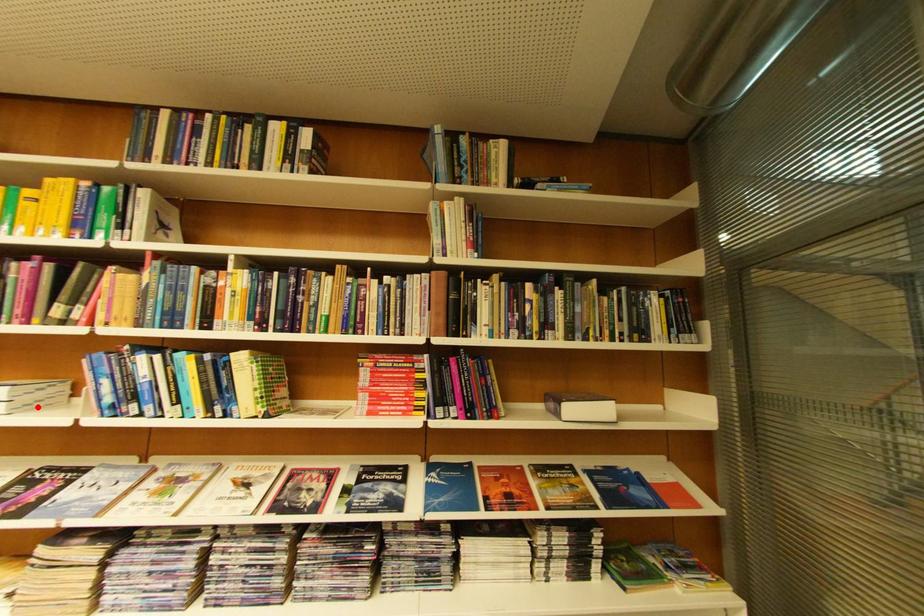
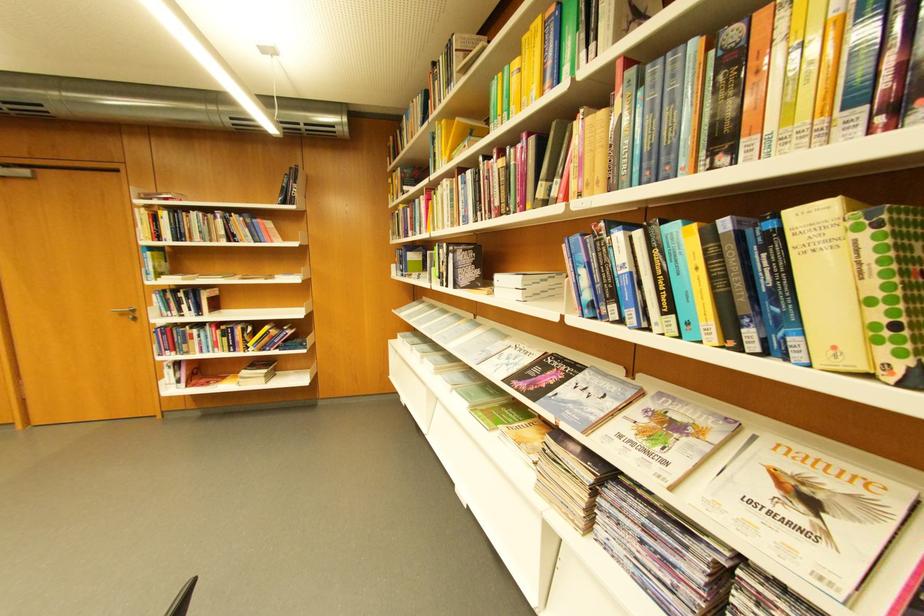
In the second image, find the point that corresponds to the highlighted location in the first image.

(544, 296)